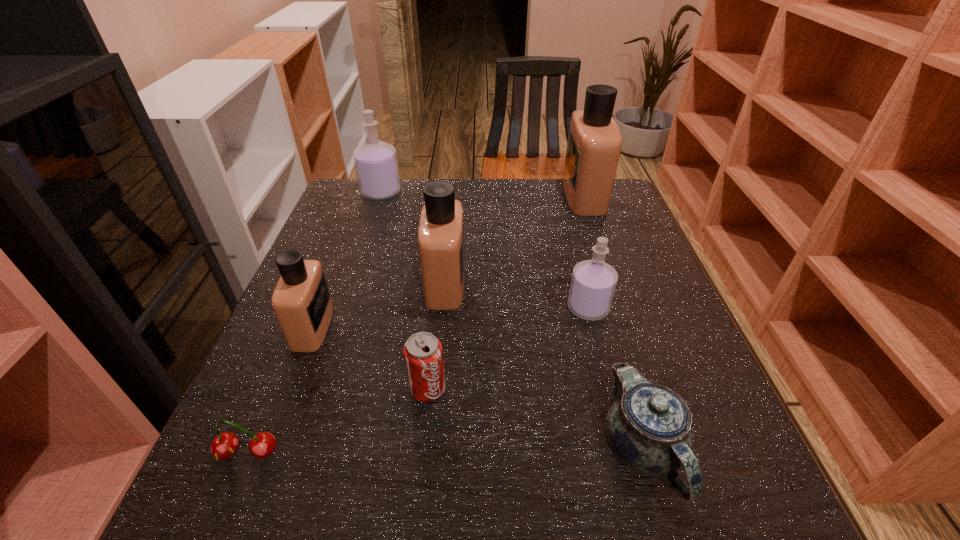
This screenshot has height=540, width=960. I want to click on chinaware, so click(648, 427).

The height and width of the screenshot is (540, 960). I want to click on cherry, so click(224, 445).

The width and height of the screenshot is (960, 540). I want to click on red cherry, so click(224, 445).

Locate an element on the screen. The height and width of the screenshot is (540, 960). vacant area situated on the front label of the rightmost beige perfume is located at coordinates (465, 196).

The image size is (960, 540). I want to click on vacant area situated 0.360m on the front label of the rightmost beige perfume, so click(440, 196).

At what (x,y) coordinates should I click in order to perform the action: click on vacant space located 0.270m on the front label of the rightmost beige perfume. Please return your answer as a coordinate pair (x, y). The image size is (960, 540). Looking at the image, I should click on (471, 196).

What are the coordinates of `vacant space positioned 0.340m on the front of the farther purple perfume` in the screenshot? It's located at (351, 283).

At what (x,y) coordinates should I click in order to perform the action: click on vacant space located 0.320m on the front label of the second smallest beige perfume. Please return your answer as a coordinate pair (x, y). Image resolution: width=960 pixels, height=540 pixels. Looking at the image, I should click on (608, 283).

The height and width of the screenshot is (540, 960). I want to click on vacant area situated 0.210m on the front label of the leftmost beige perfume, so click(434, 327).

The image size is (960, 540). What are the coordinates of `vacant space located on the back of the nearer purple perfume` in the screenshot? It's located at (578, 271).